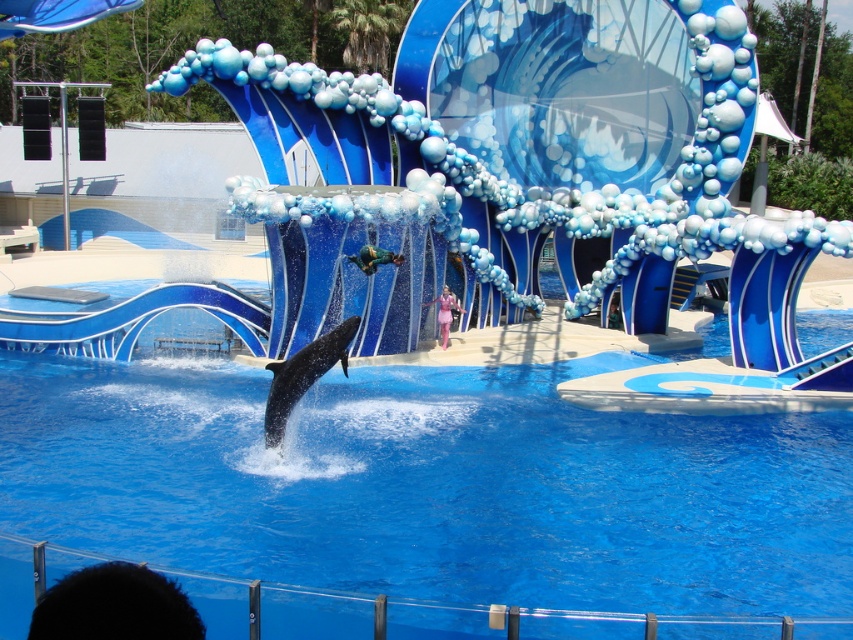
Looking at this image, you are a photographer at the marine show and need to position yourself so that both the green fabric person at center and the pink satin dress at center are visible in your frame. Which object should you place closer to the left side of your camera viewfinder to ensure both are in the shot?

The green fabric person at center is to the left of the pink satin dress at center, so you should position the green fabric person at center closer to the left side of the camera viewfinder to include both in the frame.

You are a photographer standing at the edge of the pool. You want to capture a photo where both the black smooth dolphin at center and the pink satin dress at center are visible. Which object should you focus on first if you want to ensure both are in the frame?

You should focus on the black smooth dolphin at center first because it is positioned on the left side of the pink satin dress at center, so by centering the dolphin, the dress will naturally be included in the frame.

You are a photographer standing at the edge of the pool. You need to take a photo of both the green fabric person at center and the pink satin dress at center so that both are fully visible in the frame. Based on their sizes, which object should you focus on first to ensure the smaller one is in focus?

The green fabric person at center is not as tall as the pink satin dress at center, so you should focus on the green fabric person at center first to ensure the smaller one is in focus.